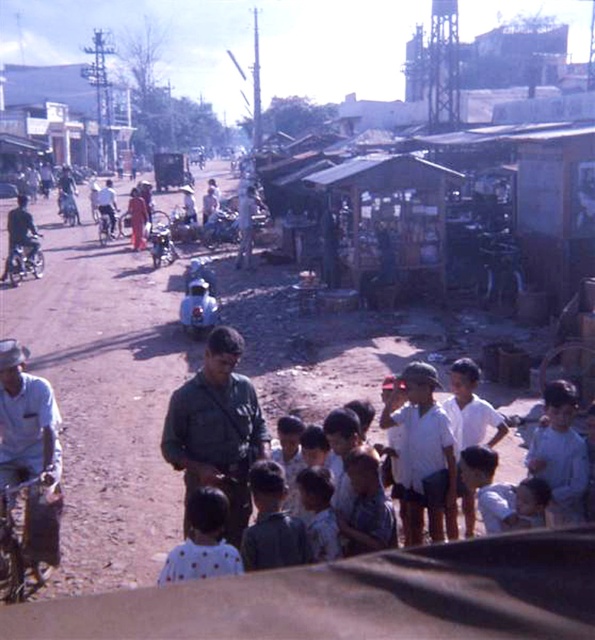
Is light blue shirt at center smaller than dark green uniform at center?

Yes.

Which is behind, point (380, 512) or point (17, 220)?

Positioned behind is point (17, 220).

What do you see at coordinates (365, 508) in the screenshot? I see `light blue shirt at center` at bounding box center [365, 508].

Where is `light blue shirt at center`? This screenshot has height=640, width=595. light blue shirt at center is located at coordinates (365, 508).

Can you confirm if brown dirt field at center is wider than dotted fabric dress at center?

Yes.

Which of these two, brown dirt field at center or dotted fabric dress at center, stands taller?

brown dirt field at center

You are a GUI agent. You are given a task and a screenshot of the screen. Output one action in this format:
    pyautogui.click(x=<x>, y=<y>)
    Task: Click on the brown dirt field at center
    The width and height of the screenshot is (595, 640).
    Given the screenshot: What is the action you would take?
    pyautogui.click(x=105, y=396)

Is the position of dotted fabric dress at center less distant than that of blue matte motorcycle at left?

Yes, dotted fabric dress at center is closer to the viewer.

Between dotted fabric dress at center and blue matte motorcycle at left, which one appears on the left side from the viewer's perspective?

blue matte motorcycle at left is more to the left.

Is point (330, 547) positioned after point (26, 262)?

That is False.

I want to click on dotted fabric dress at center, so click(318, 513).